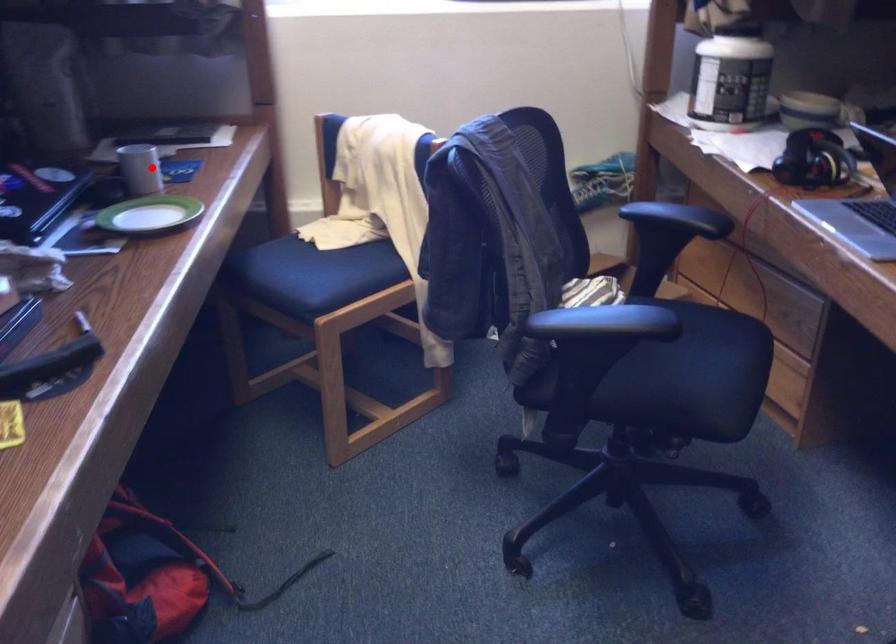
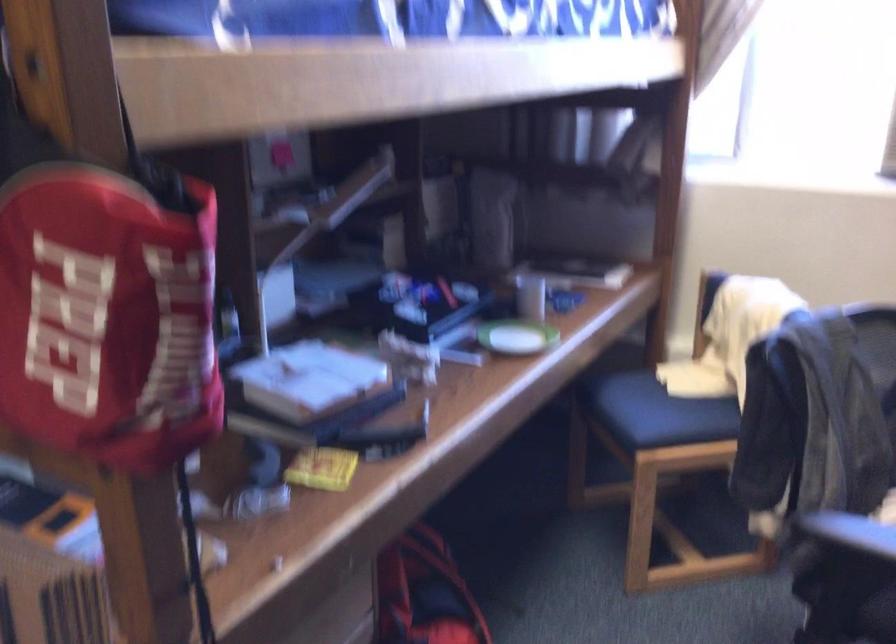
The point at the highlighted location is marked in the first image. Where is the corresponding point in the second image?

(530, 297)